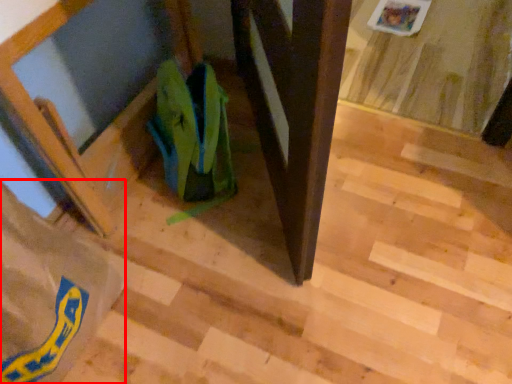
Question: From the image's perspective, where is grocery bag (annotated by the red box) located in relation to grocery bag in the image?

Choices:
 (A) above
 (B) below

Answer: (B)